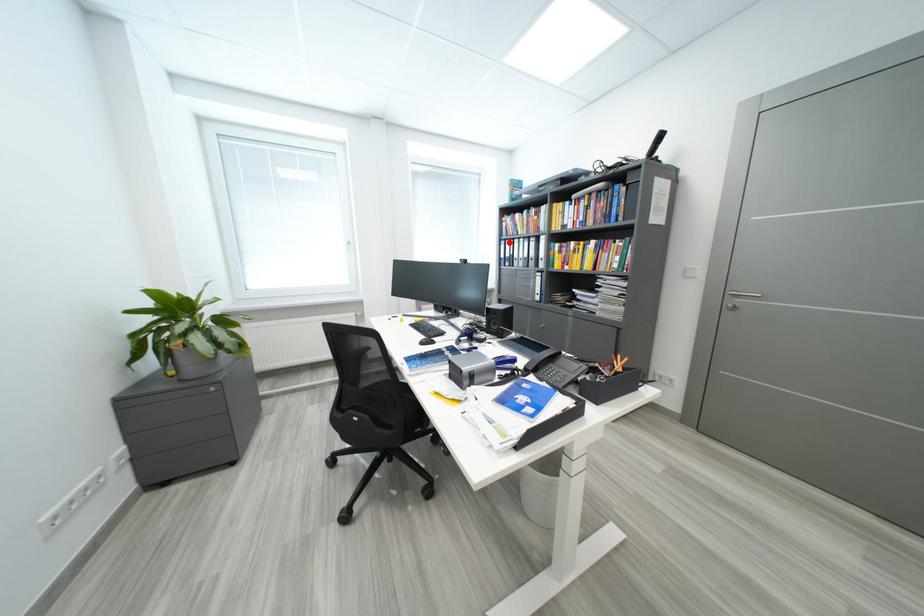
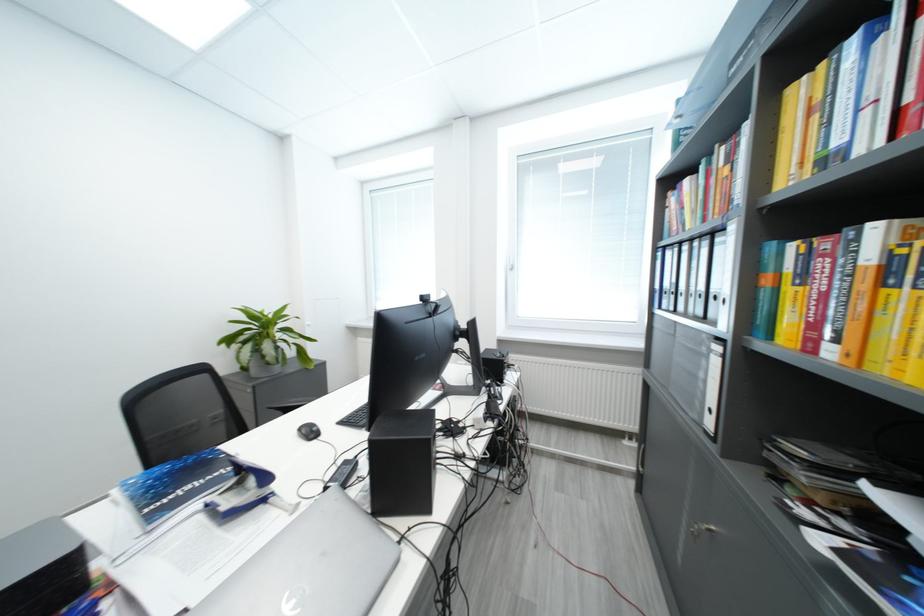
Where in the second image is the point corresponding to the highlighted location from the first image?

(664, 253)